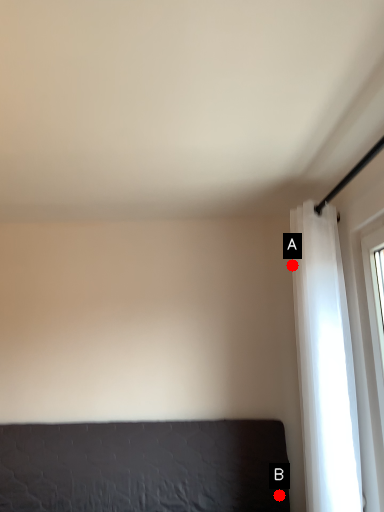
Question: Two points are circled on the image, labeled by A and B beside each circle. Which point is farther from the camera taking this photo?

Choices:
 (A) A is further
 (B) B is further

Answer: (B)